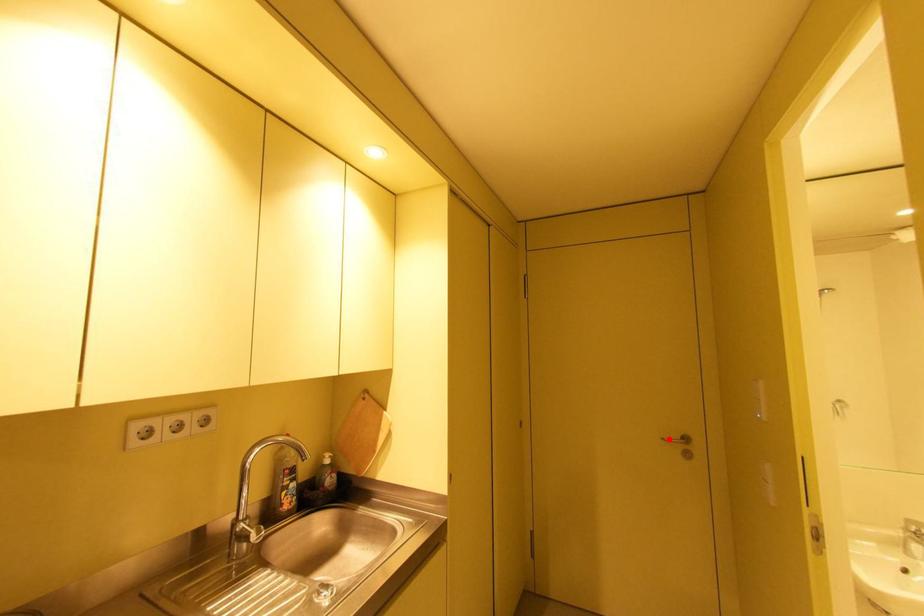
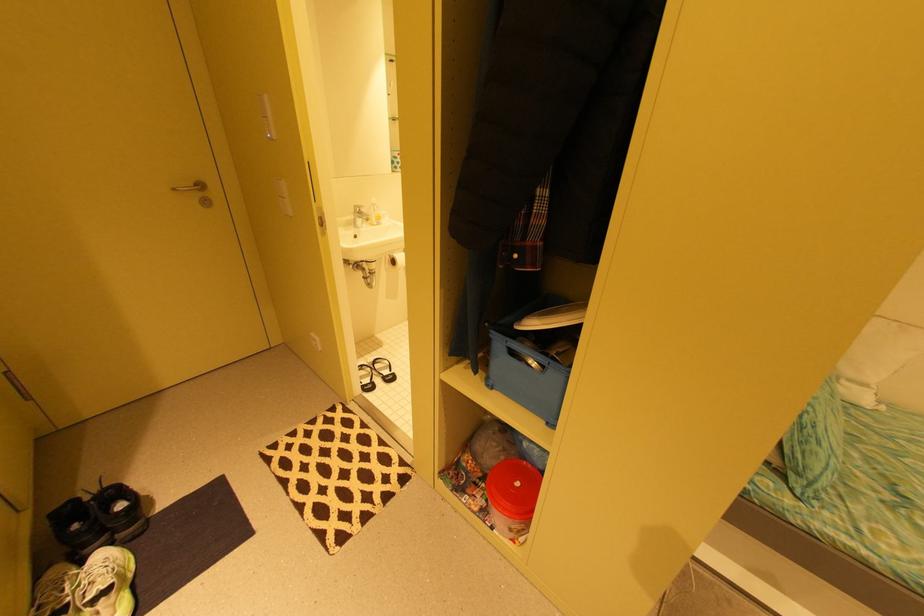
Find the pixel in the second image that matches the highlighted location in the first image.

(179, 190)